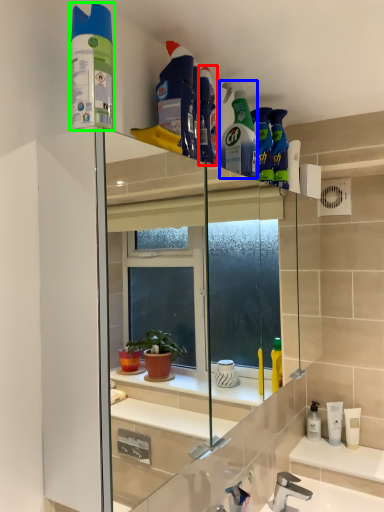
Question: Based on their relative distances, which object is farther from cleaning product (highlighted by a red box)? Choose from cleaning product (highlighted by a blue box) and cleaning product (highlighted by a green box).

Choices:
 (A) cleaning product
 (B) cleaning product

Answer: (B)